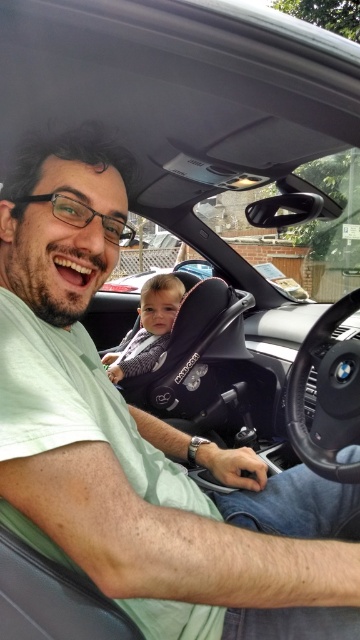
You are a safety inspector checking the car seats in this vehicle. You notice the black leather steering wheel at center and the soft gray fabric baby car seat at center. Which object is positioned closer to the front of the car?

The black leather steering wheel at center is closer to the viewer than the soft gray fabric baby car seat at center, so it is positioned closer to the front of the car.

You are a car designer evaluating the interior space of this BMW. You need to determine if there is enough legroom between the black leather steering wheel at center and the soft gray fabric baby car seat at center for a 160 cm tall driver. Can you confirm if the available space is sufficient?

The black leather steering wheel at center is shorter than the soft gray fabric baby car seat at center, but the height difference alone does not determine legroom. Legroom depends on the distance between the driver and the car seat, which is not specified here. Therefore, we cannot confirm if the space is sufficient based on the provided information.